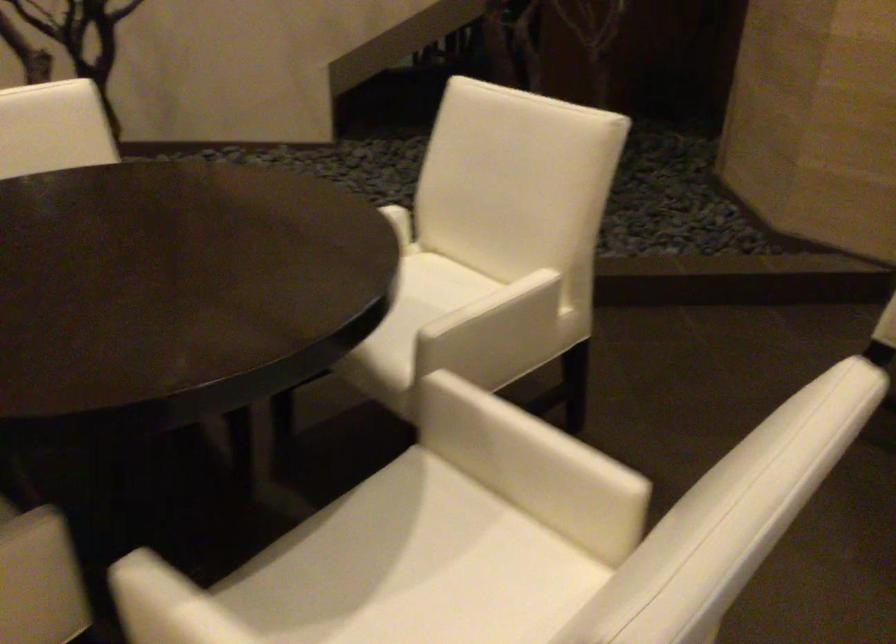
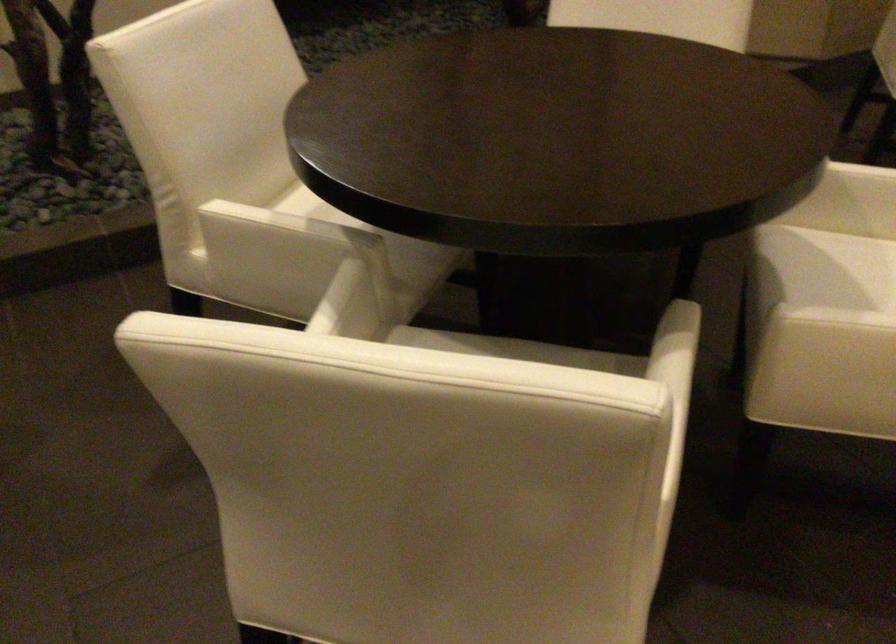
Where in the second image is the point corresponding to point 414,532 from the first image?

(855, 266)